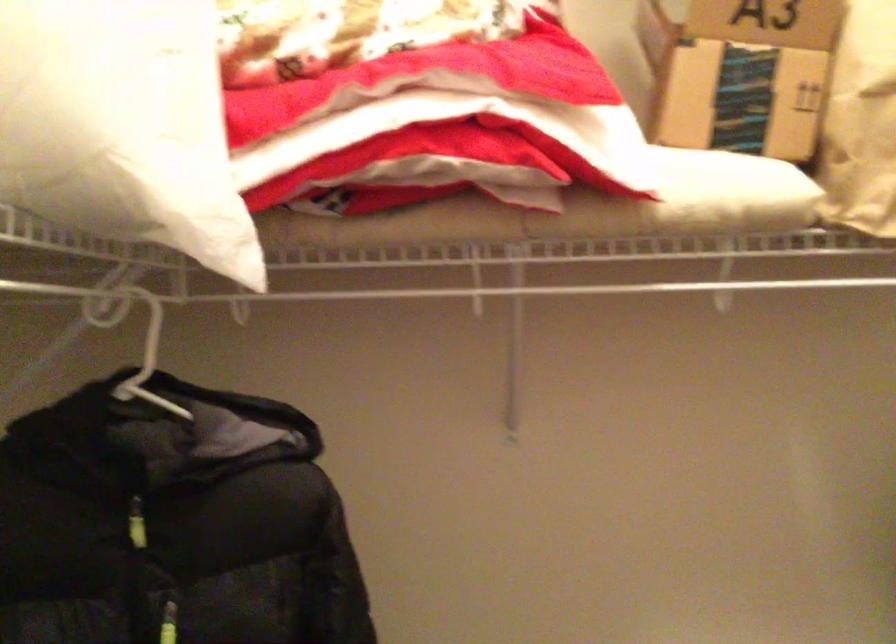
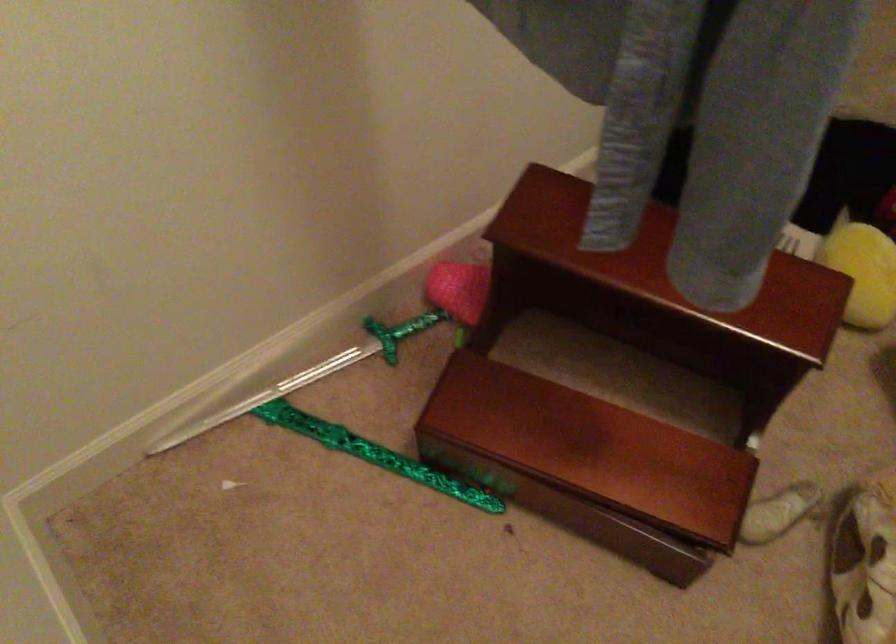
How did the camera likely rotate?

The camera's rotation is toward left-down.